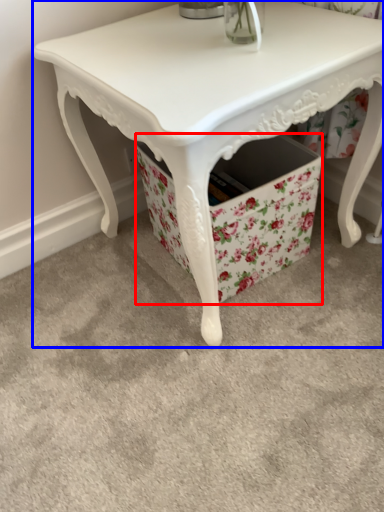
Question: Which object appears closest to the camera in this image, storage box (highlighted by a red box) or table (highlighted by a blue box)?

Choices:
 (A) storage box
 (B) table

Answer: (B)